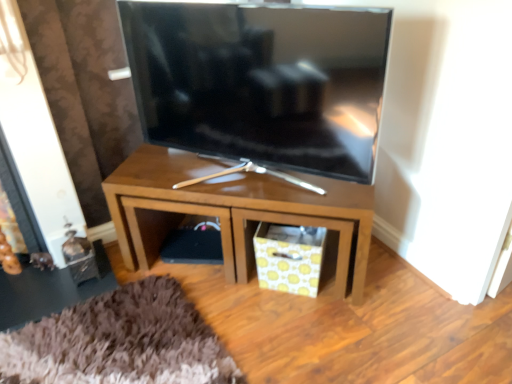
Identify the location of empty space that is ontop of wooden tv stand at center. Image resolution: width=512 pixels, height=384 pixels. (223, 173).